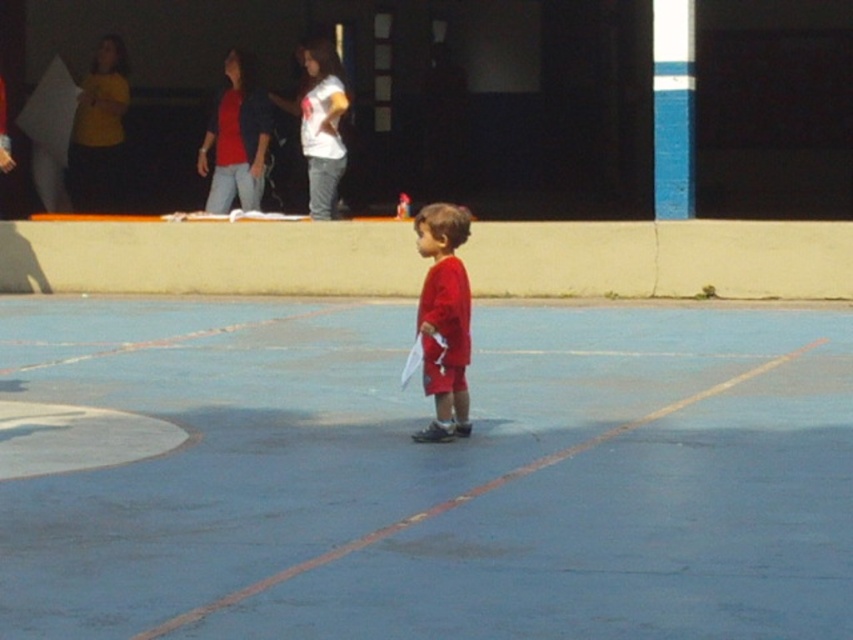
You are a photographer trying to capture a photo of the blue rubber basketball court at center and the matte red shorts at center from the left side of the scene. Which object should be placed on the right side of the photo to ensure proper alignment with their actual positions?

The matte red shorts at center should be placed on the right side of the photo because the blue rubber basketball court at center is positioned on the left side of the matte red shorts at center in the scene.

You are a parent at the playground. You see the blue rubber basketball court at center and the matte red shorts at center. Which object is taller?

The matte red shorts at center are taller than the blue rubber basketball court at center.

You are a parent at the sports court. You want to place a small toy on the blue rubber basketball court at center so that it stays away from the matte red shorts at center. Where should you put it?

Since the blue rubber basketball court at center is larger than the matte red shorts at center, placing the toy near the edge of the court away from the matte red shorts at center would ensure it stays away.